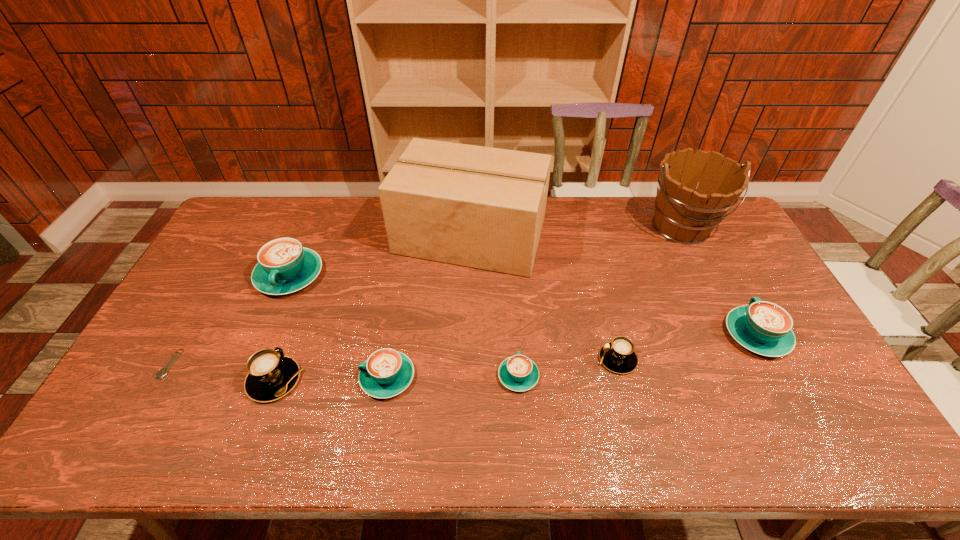
Identify the location of box. (481, 207).

What are the coordinates of `wine bucket` in the screenshot? It's located at (685, 213).

Where is `the tallest cappuccino`? the tallest cappuccino is located at coordinates (284, 266).

In order to click on the farthest turquoise cappuccino in this screenshot , I will do `click(284, 266)`.

You are a GUI agent. You are given a task and a screenshot of the screen. Output one action in this format:
    pyautogui.click(x=<x>, y=<y>)
    Task: Click on the rightmost cappuccino
    
    Given the screenshot: What is the action you would take?
    pyautogui.click(x=765, y=328)

Find the location of a particular element. The image size is (960, 540). the rightmost turquoise cappuccino is located at coordinates [x=765, y=328].

Where is `the left black cappuccino`? The height and width of the screenshot is (540, 960). the left black cappuccino is located at coordinates (271, 376).

The height and width of the screenshot is (540, 960). Identify the location of the third biggest turquoise cappuccino. (386, 373).

Where is `the third cappuccino from left to right`? the third cappuccino from left to right is located at coordinates (386, 373).

At what (x,y) coordinates should I click in order to perform the action: click on the smaller black cappuccino. Please return your answer as a coordinate pair (x, y). Looking at the image, I should click on (618, 356).